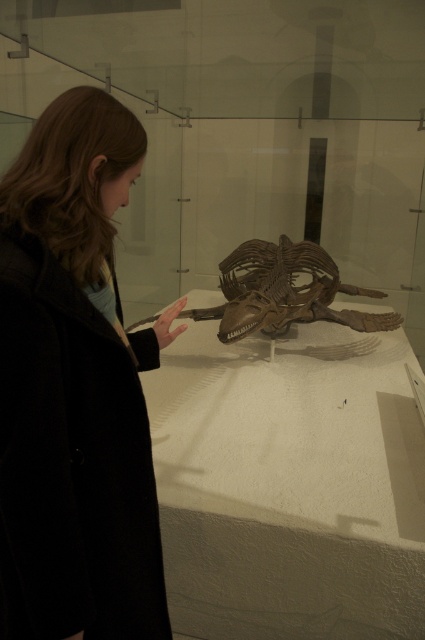
Question: Which point is farther to the camera?

Choices:
 (A) (221, 285)
 (B) (48, 618)

Answer: (A)

Question: Is black wool coat at left smaller than brown wooden skeleton at center?

Choices:
 (A) yes
 (B) no

Answer: (A)

Question: Is black wool coat at left in front of brown wooden skeleton at center?

Choices:
 (A) no
 (B) yes

Answer: (B)

Question: Does black wool coat at left have a lesser width compared to brown wooden skeleton at center?

Choices:
 (A) yes
 (B) no

Answer: (A)

Question: Which point appears closest to the camera in this image?

Choices:
 (A) (343, 310)
 (B) (105, 378)

Answer: (B)